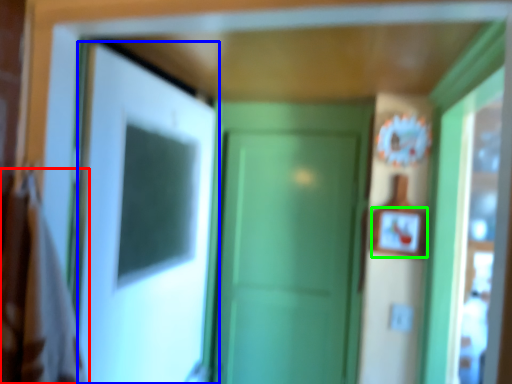
Question: Which object is the closest to the laundry (highlighted by a red box)? Choose among these: door (highlighted by a blue box) or picture frame (highlighted by a green box).

Choices:
 (A) door
 (B) picture frame

Answer: (A)